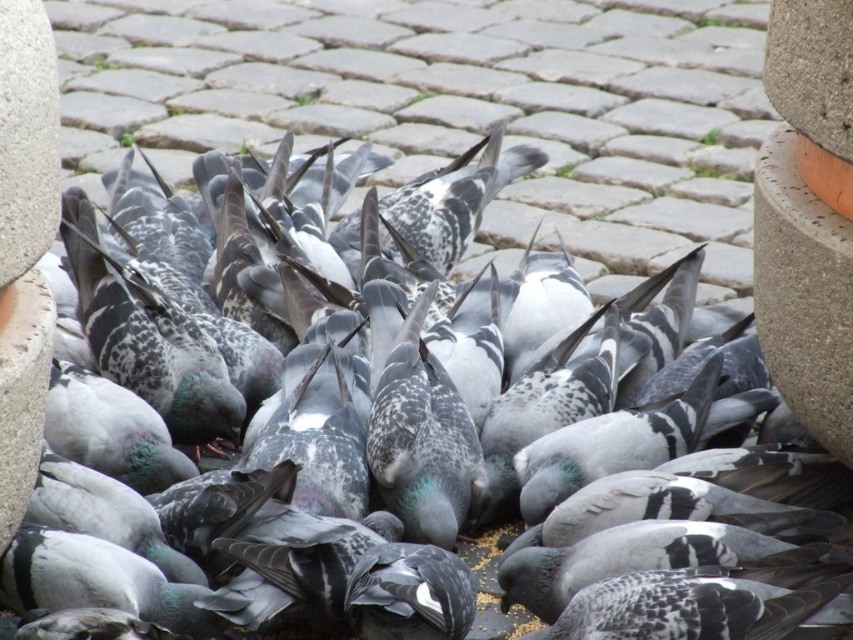
Question: Can you confirm if gray stone pavement at center is positioned to the right of concrete textured pillar at right?

Choices:
 (A) yes
 (B) no

Answer: (B)

Question: Is gray stone pavement at center positioned in front of concrete textured pillar at right?

Choices:
 (A) yes
 (B) no

Answer: (B)

Question: Is gray stone pavement at center wider than concrete textured pillar at right?

Choices:
 (A) no
 (B) yes

Answer: (A)

Question: Which point appears farthest from the camera in this image?

Choices:
 (A) (764, 56)
 (B) (705, 108)

Answer: (B)

Question: Among these objects, which one is nearest to the camera?

Choices:
 (A) gray stone pavement at center
 (B) concrete textured pillar at right

Answer: (B)